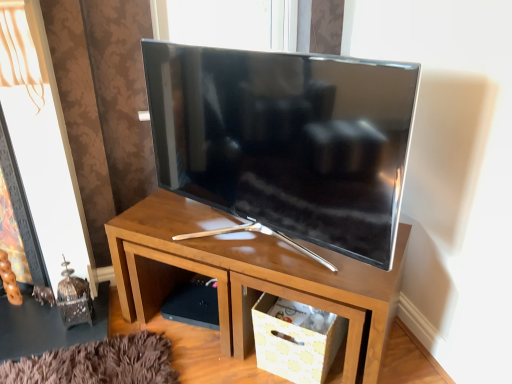
Question: Is wooden tv stand at center facing towards satin black tv at center?

Choices:
 (A) yes
 (B) no

Answer: (B)

Question: Is wooden tv stand at center bigger than satin black tv at center?

Choices:
 (A) no
 (B) yes

Answer: (B)

Question: Can satin black tv at center be found inside wooden tv stand at center?

Choices:
 (A) yes
 (B) no

Answer: (B)

Question: From the image's perspective, does wooden tv stand at center appear lower than satin black tv at center?

Choices:
 (A) yes
 (B) no

Answer: (A)

Question: Considering the relative positions of wooden tv stand at center and satin black tv at center in the image provided, is wooden tv stand at center behind satin black tv at center?

Choices:
 (A) no
 (B) yes

Answer: (B)

Question: Considering the positions of satin black tv at center and white paper storage box at lower right in the image, is satin black tv at center taller or shorter than white paper storage box at lower right?

Choices:
 (A) short
 (B) tall

Answer: (B)

Question: Considering the positions of point (225, 201) and point (317, 314), is point (225, 201) closer or farther from the camera than point (317, 314)?

Choices:
 (A) closer
 (B) farther

Answer: (A)

Question: Is satin black tv at center inside the boundaries of white paper storage box at lower right, or outside?

Choices:
 (A) outside
 (B) inside

Answer: (A)

Question: From a real-world perspective, is satin black tv at center positioned above or below white paper storage box at lower right?

Choices:
 (A) below
 (B) above

Answer: (B)

Question: In the image, is wooden tv stand at center positioned in front of or behind white paper storage box at lower right?

Choices:
 (A) front
 (B) behind

Answer: (A)

Question: In terms of height, does wooden tv stand at center look taller or shorter compared to white paper storage box at lower right?

Choices:
 (A) short
 (B) tall

Answer: (B)

Question: From the image's perspective, relative to white paper storage box at lower right, is wooden tv stand at center above or below?

Choices:
 (A) below
 (B) above

Answer: (B)

Question: Is point (391, 296) closer or farther from the camera than point (316, 355)?

Choices:
 (A) farther
 (B) closer

Answer: (B)

Question: Considering the positions of point (340, 332) and point (111, 228), is point (340, 332) closer or farther from the camera than point (111, 228)?

Choices:
 (A) farther
 (B) closer

Answer: (A)

Question: Considering their positions, is white paper storage box at lower right located in front of or behind wooden tv stand at center?

Choices:
 (A) front
 (B) behind

Answer: (B)